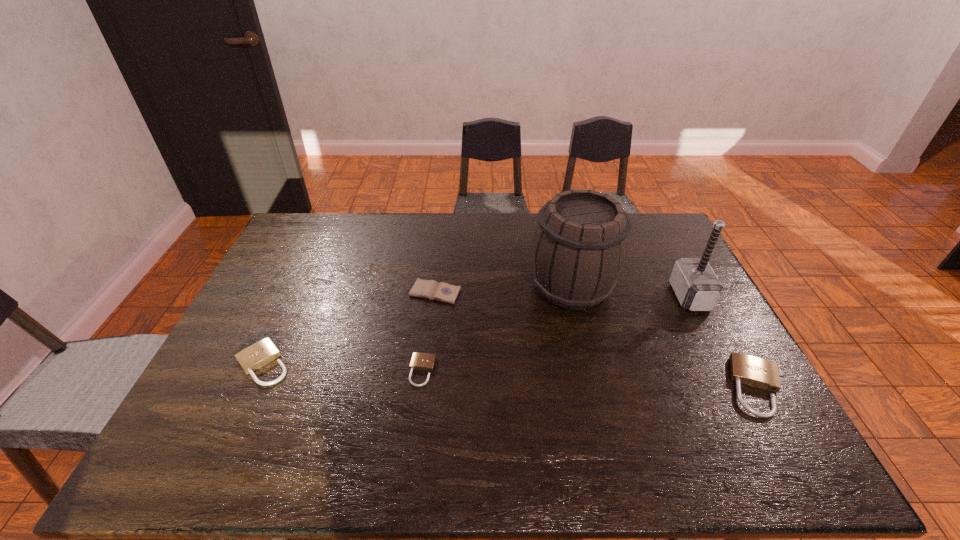
Locate an element on the screen. Image resolution: width=960 pixels, height=540 pixels. free area in between the diary and the second padlock from right to left is located at coordinates (429, 332).

The height and width of the screenshot is (540, 960). I want to click on free space between the shortest padlock and the leftmost object, so click(x=343, y=368).

At what (x,y) coordinates should I click in order to perform the action: click on vacant region between the rightmost padlock and the third object from right to left. Please return your answer as a coordinate pair (x, y). Looking at the image, I should click on (664, 337).

At what (x,y) coordinates should I click in order to perform the action: click on vacant area between the wine bucket and the hammer. Please return your answer as a coordinate pair (x, y). Looking at the image, I should click on (x=631, y=292).

I want to click on object identified as the fourth closest to the wine bucket, so click(420, 361).

Where is `object that is the third closest to the leftmost padlock`? This screenshot has width=960, height=540. object that is the third closest to the leftmost padlock is located at coordinates (580, 245).

Choose which padlock is the second nearest neighbor to the diary. Please provide its 2D coordinates. Your answer should be formatted as a tuple, i.e. [(x, y)], where the tuple contains the x and y coordinates of a point satisfying the conditions above.

[(252, 358)]

Find the location of a particular element. The width and height of the screenshot is (960, 540). padlock identified as the second closest to the fourth object from left to right is located at coordinates (420, 361).

This screenshot has width=960, height=540. Find the location of `vacant area that satisfies the following two spatial constraints: 1. on the front side of the fourth tallest object; 2. on the right side of the rightmost padlock`. vacant area that satisfies the following two spatial constraints: 1. on the front side of the fourth tallest object; 2. on the right side of the rightmost padlock is located at coordinates (252, 387).

The width and height of the screenshot is (960, 540). I want to click on free spot that satisfies the following two spatial constraints: 1. on the front side of the second padlock from right to left; 2. on the left side of the second shortest padlock, so click(x=259, y=371).